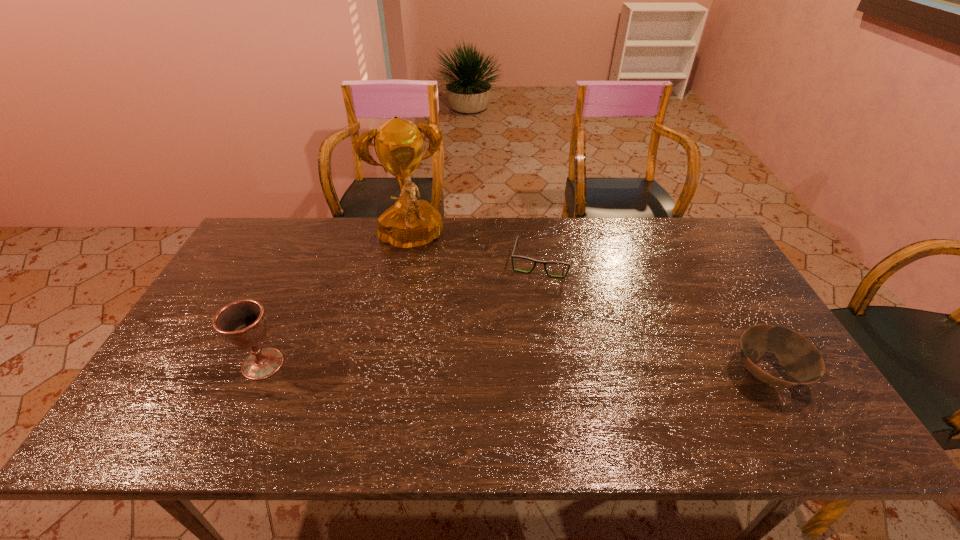
The image size is (960, 540). What are the coordinates of `free area in between the second shortest object and the leftmost object` in the screenshot? It's located at (515, 369).

The height and width of the screenshot is (540, 960). I want to click on free space that is in between the bowl and the third shortest object, so pos(515,369).

You are a GUI agent. You are given a task and a screenshot of the screen. Output one action in this format:
    pyautogui.click(x=<x>, y=<y>)
    Task: Click on the vacant area that lies between the award and the third tallest object
    
    Given the screenshot: What is the action you would take?
    pyautogui.click(x=588, y=309)

Locate an element on the screen. vacant point located between the chalice and the shortest object is located at coordinates (402, 314).

Find the location of a particular element. vacant region between the rightmost object and the leftmost object is located at coordinates coord(515,369).

The height and width of the screenshot is (540, 960). What are the coordinates of `object identified as the second closest to the third object from right to left` in the screenshot? It's located at (243, 324).

Identify which object is the second closest to the bowl. Please provide its 2D coordinates. Your answer should be formatted as a tuple, i.e. [(x, y)], where the tuple contains the x and y coordinates of a point satisfying the conditions above.

[(410, 224)]

The height and width of the screenshot is (540, 960). Find the location of `vacant space that satisfies the following two spatial constraints: 1. on the back side of the third shortest object; 2. on the left side of the award`. vacant space that satisfies the following two spatial constraints: 1. on the back side of the third shortest object; 2. on the left side of the award is located at coordinates (318, 242).